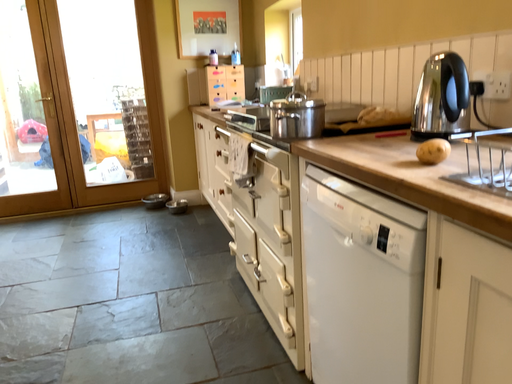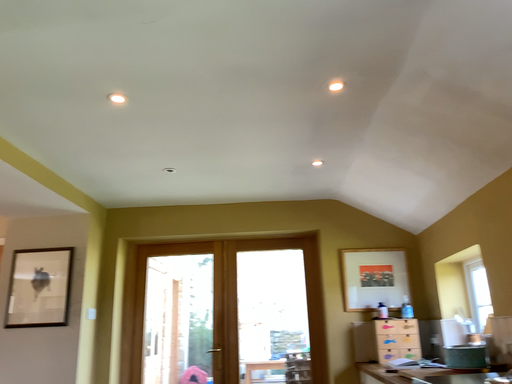
Question: Which way did the camera rotate in the video?

Choices:
 (A) rotated downward
 (B) rotated upward

Answer: (B)